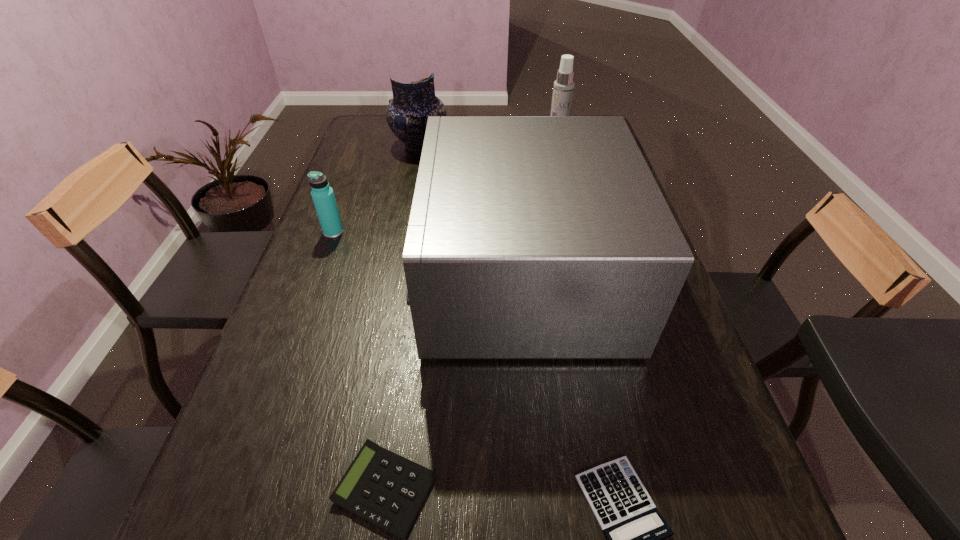
You are a GUI agent. You are given a task and a screenshot of the screen. Output one action in this format:
    pyautogui.click(x=<x>, y=<y>)
    Task: Click on the vacant space located 0.160m with the door open on the fifth shortest object
    The width and height of the screenshot is (960, 540).
    Given the screenshot: What is the action you would take?
    pyautogui.click(x=360, y=276)

This screenshot has width=960, height=540. I want to click on vacant area situated on the front of the fourth shortest object, so pyautogui.click(x=415, y=170).

The width and height of the screenshot is (960, 540). What are the coordinates of `vacant area situated on the front of the third shortest object` in the screenshot? It's located at (309, 299).

Where is `object positioned at the far edge`? This screenshot has width=960, height=540. object positioned at the far edge is located at coordinates (407, 113).

The width and height of the screenshot is (960, 540). Find the location of `pottery present at the left edge`. pottery present at the left edge is located at coordinates (407, 113).

This screenshot has width=960, height=540. In order to click on thermos bottle that is at the left edge in this screenshot , I will do `click(322, 194)`.

Where is `object that is at the right edge`? This screenshot has height=540, width=960. object that is at the right edge is located at coordinates (530, 237).

Locate an element on the screen. This screenshot has width=960, height=540. object that is at the far left corner is located at coordinates (407, 113).

This screenshot has height=540, width=960. In the image, there is a desktop. Identify the location of vacant space at the left edge. (301, 276).

Locate which object ranks fourth in proximity to the second farthest object. Please provide its 2D coordinates. Your answer should be formatted as a tuple, i.e. [(x, y)], where the tuple contains the x and y coordinates of a point satisfying the conditions above.

[(634, 528)]